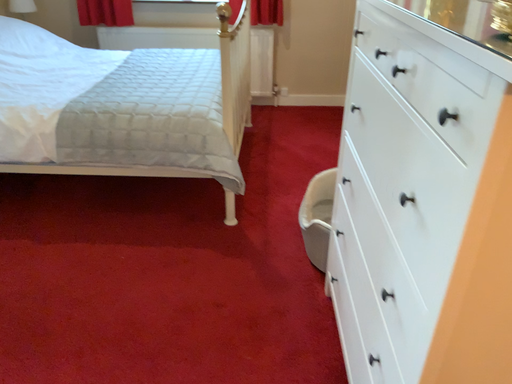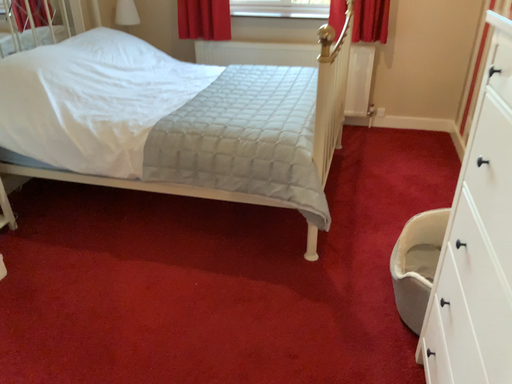
Question: How did the camera likely rotate when shooting the video?

Choices:
 (A) rotated left
 (B) rotated right

Answer: (A)